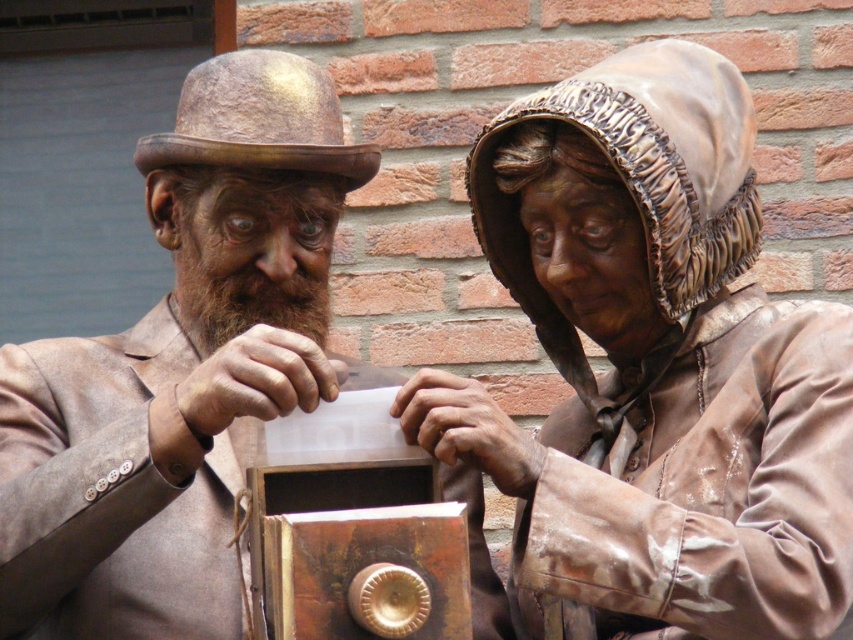
Question: Can you confirm if bronze statue at center is positioned to the right of rustic bronze statue at center?

Choices:
 (A) yes
 (B) no

Answer: (A)

Question: Is bronze statue at center closer to the viewer compared to rustic bronze statue at center?

Choices:
 (A) no
 (B) yes

Answer: (B)

Question: Is bronze statue at center below rustic bronze statue at center?

Choices:
 (A) no
 (B) yes

Answer: (B)

Question: Which point is closer to the camera?

Choices:
 (A) (495, 609)
 (B) (247, 144)

Answer: (B)

Question: Among these objects, which one is nearest to the camera?

Choices:
 (A) rustic bronze statue at center
 (B) bronze statue at center

Answer: (B)

Question: Which object appears farthest from the camera in this image?

Choices:
 (A) bronze statue at center
 (B) rustic bronze statue at center

Answer: (B)